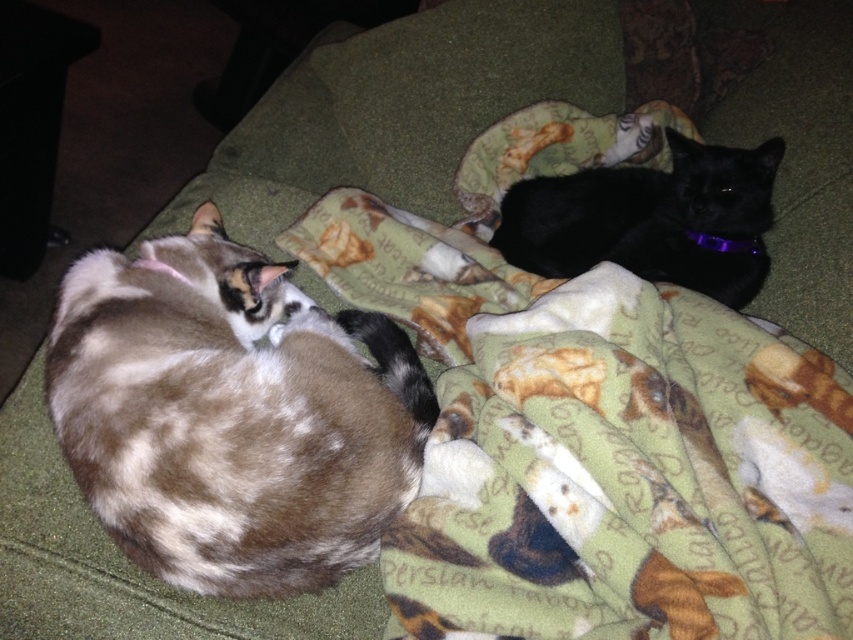
Question: Is green fleece blanket at center thinner than black matte/black fur cat at upper right?

Choices:
 (A) no
 (B) yes

Answer: (A)

Question: Which point is closer to the camera?

Choices:
 (A) (103, 500)
 (B) (758, 252)
 (C) (614, 580)

Answer: (C)

Question: Is black matte/black fur cat at upper right wider than purple fabric neckband at upper right?

Choices:
 (A) yes
 (B) no

Answer: (A)

Question: Which point appears farthest from the camera in this image?

Choices:
 (A) (469, 266)
 (B) (91, 317)

Answer: (A)

Question: Can you confirm if calico fur cat at center is positioned above black matte/black fur cat at upper right?

Choices:
 (A) no
 (B) yes

Answer: (A)

Question: Which object is farther from the camera taking this photo?

Choices:
 (A) green fleece blanket at center
 (B) calico fur cat at center
 (C) black matte/black fur cat at upper right
 (D) purple fabric neckband at upper right

Answer: (D)